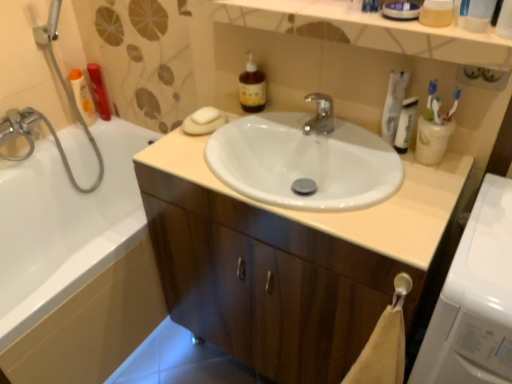
Where is `vacant space to the right of white matte soap at upper center`? vacant space to the right of white matte soap at upper center is located at coordinates (256, 123).